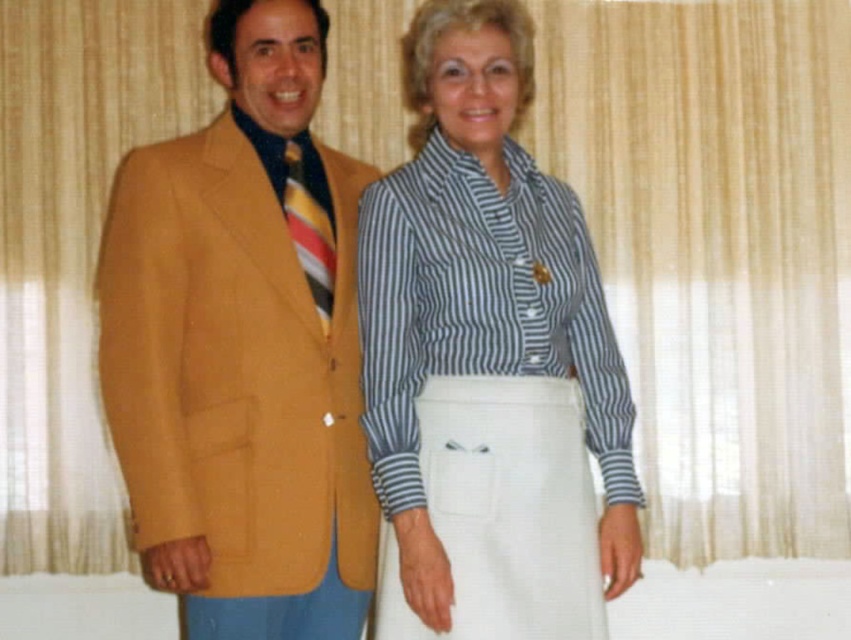
Between matte gold blazer at left and striped cotton shirt at center, which one is positioned lower?

matte gold blazer at left is lower down.

Who is more forward, [227,20] or [431,452]?

Point [431,452] is in front.

Locate an element on the screen. The width and height of the screenshot is (851, 640). matte gold blazer at left is located at coordinates (243, 348).